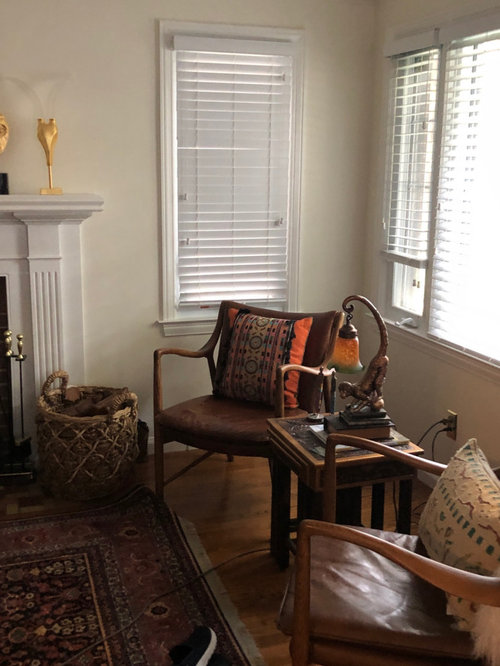
Where is `fireplace`? fireplace is located at coordinates (8, 292).